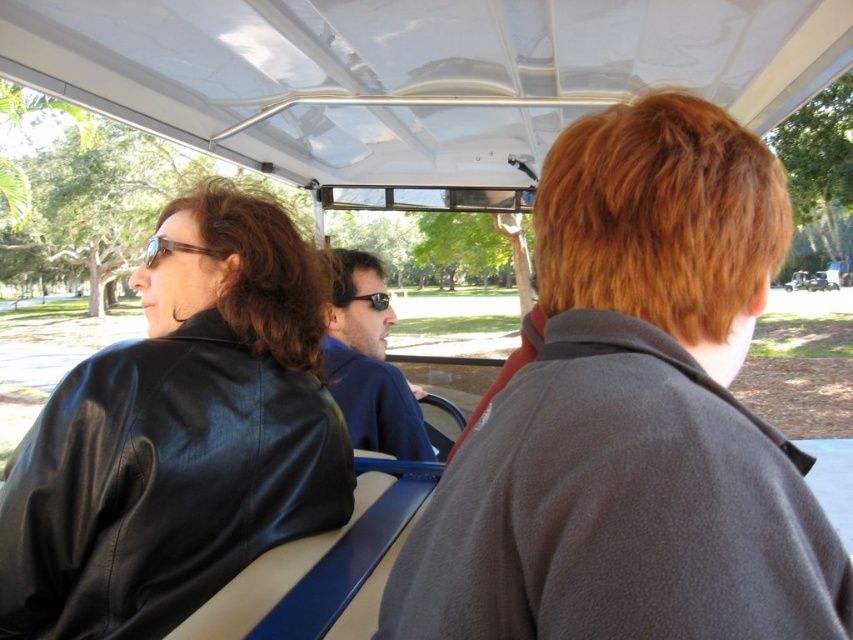
Measure the distance between blue leather jacket at center and camera.

blue leather jacket at center and camera are 1.28 meters apart.

Which is behind, point (361, 330) or point (213, 257)?

Positioned behind is point (361, 330).

This screenshot has width=853, height=640. What are the coordinates of `blue leather jacket at center` in the screenshot? It's located at (368, 364).

Is blue leather jacket at center closer to camera compared to black plastic sunglasses at center?

That is True.

Does blue leather jacket at center have a smaller size compared to black plastic sunglasses at center?

No, blue leather jacket at center is not smaller than black plastic sunglasses at center.

This screenshot has height=640, width=853. In order to click on blue leather jacket at center in this screenshot , I will do `click(368, 364)`.

Find the location of a particular element. This screenshot has height=640, width=853. blue leather jacket at center is located at coordinates tap(368, 364).

Who is positioned more to the left, matte black leather jacket at left or black plastic sunglasses at center?

matte black leather jacket at left

Does matte black leather jacket at left have a greater width compared to black plastic sunglasses at center?

Yes, matte black leather jacket at left is wider than black plastic sunglasses at center.

At what (x,y) coordinates should I click in order to perform the action: click on matte black leather jacket at left. Please return your answer as a coordinate pair (x, y). Looking at the image, I should click on (178, 436).